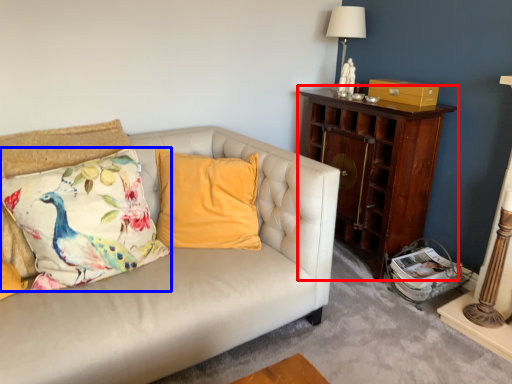
Question: Among these objects, which one is nearest to the camera, nightstand (highlighted by a red box) or pillow (highlighted by a blue box)?

Choices:
 (A) nightstand
 (B) pillow

Answer: (B)